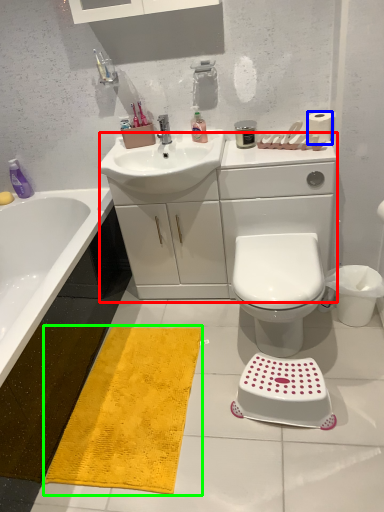
Question: Which is nearer to the counter top (highlighted by a red box)? toilet paper (highlighted by a blue box) or doormat (highlighted by a green box).

Choices:
 (A) toilet paper
 (B) doormat

Answer: (A)